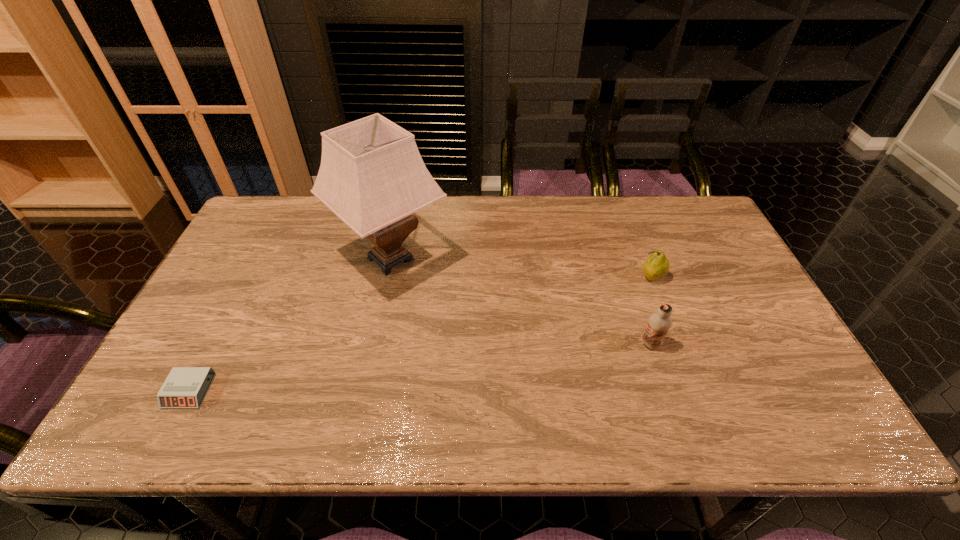
The height and width of the screenshot is (540, 960). I want to click on lampshade, so click(x=372, y=176).

At what (x,y) coordinates should I click in order to perform the action: click on the third object from right to left. Please return your answer as a coordinate pair (x, y). This screenshot has width=960, height=540. Looking at the image, I should click on (372, 176).

Identify the location of the second object from right to left. The height and width of the screenshot is (540, 960). (659, 323).

Locate an element on the screen. The width and height of the screenshot is (960, 540). the third farthest object is located at coordinates (659, 323).

Find the location of a particular element. the rightmost object is located at coordinates (657, 265).

Image resolution: width=960 pixels, height=540 pixels. I want to click on the third tallest object, so click(657, 265).

The width and height of the screenshot is (960, 540). Find the location of `alarm clock`. alarm clock is located at coordinates (185, 387).

Identify the location of the leftmost object. The image size is (960, 540). (185, 387).

In order to click on vacant space located 0.320m on the right of the third object from right to left in this screenshot , I will do `click(557, 259)`.

Where is `free location located 0.230m on the right of the third shortest object`? The width and height of the screenshot is (960, 540). free location located 0.230m on the right of the third shortest object is located at coordinates (753, 344).